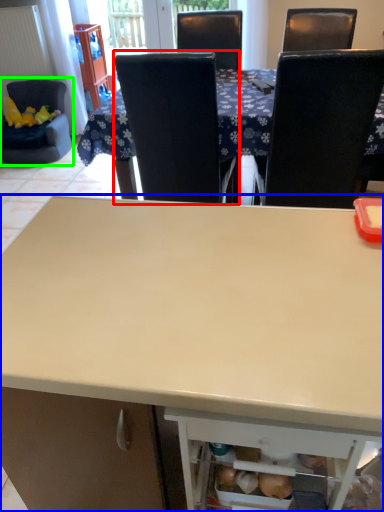
Question: Which object is the farthest from chair (highlighted by a red box)? Choose among these: desk (highlighted by a blue box) or chair (highlighted by a green box).

Choices:
 (A) desk
 (B) chair

Answer: (B)